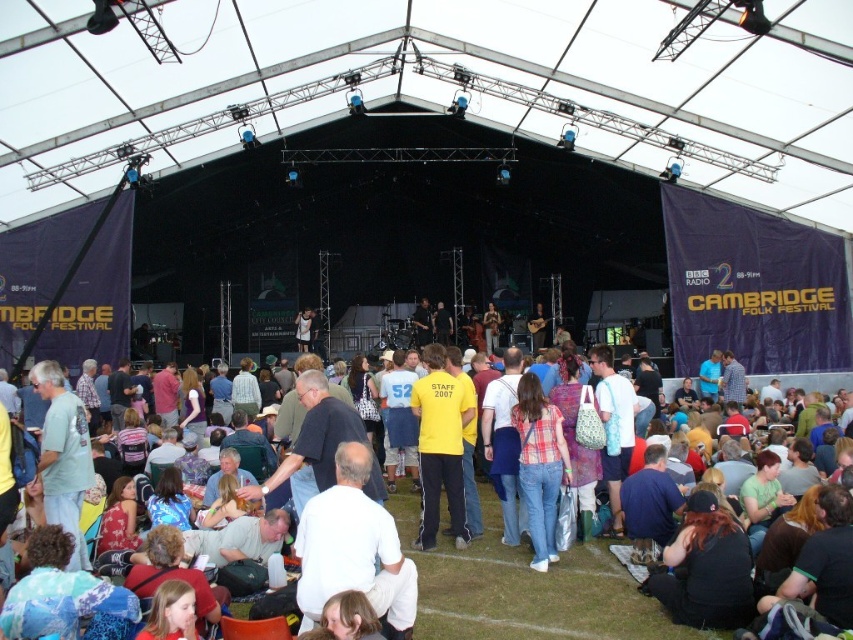
Question: Does plaid shirt at center have a greater width compared to matte yellow t-shirt at center?

Choices:
 (A) yes
 (B) no

Answer: (B)

Question: Does white cotton shirt at lower center have a smaller size compared to plaid shirt at center?

Choices:
 (A) yes
 (B) no

Answer: (B)

Question: Considering the real-world distances, which object is closest to the plaid shirt at center?

Choices:
 (A) matte yellow t-shirt at center
 (B) white cotton shirt at lower center
 (C) yellow cotton shirt at center
 (D) yellow cotton t-shirt at center

Answer: (D)

Question: Which of the following is the closest to the observer?

Choices:
 (A) (552, 538)
 (B) (310, 344)

Answer: (A)

Question: Is white cotton shirt at lower center positioned behind plaid shirt at center?

Choices:
 (A) yes
 (B) no

Answer: (B)

Question: Which object is closer to the camera taking this photo?

Choices:
 (A) plaid shirt at center
 (B) matte yellow t-shirt at center
 (C) yellow cotton t-shirt at center

Answer: (C)